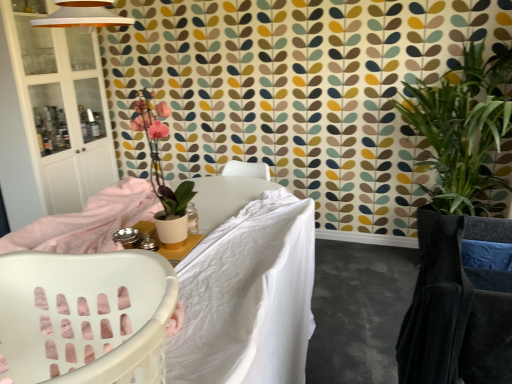
Question: Is white fabric bed at center not close to matte white pot at upper left, marked as the 1th houseplant in a left-to-right arrangement?

Choices:
 (A) no
 (B) yes

Answer: (B)

Question: From the image's perspective, is white fabric bed at center over matte white pot at upper left, arranged as the second houseplant when viewed from the back?

Choices:
 (A) no
 (B) yes

Answer: (A)

Question: Is the position of white fabric bed at center less distant than that of matte white pot at upper left, which ranks as the first houseplant in front-to-back order?

Choices:
 (A) yes
 (B) no

Answer: (A)

Question: From a real-world perspective, is white fabric bed at center physically above matte white pot at upper left, which ranks as the first houseplant in front-to-back order?

Choices:
 (A) no
 (B) yes

Answer: (A)

Question: Considering the relative sizes of white fabric bed at center and matte white pot at upper left, marked as the 1th houseplant in a left-to-right arrangement, in the image provided, is white fabric bed at center smaller than matte white pot at upper left, marked as the 1th houseplant in a left-to-right arrangement,?

Choices:
 (A) no
 (B) yes

Answer: (A)

Question: From the image's perspective, is white fabric bed at center under matte white pot at upper left, which is the second houseplant in right-to-left order?

Choices:
 (A) yes
 (B) no

Answer: (A)

Question: Considering the relative sizes of matte white pot at upper left, marked as the 1th houseplant in a left-to-right arrangement, and matte white table at center in the image provided, is matte white pot at upper left, marked as the 1th houseplant in a left-to-right arrangement, smaller than matte white table at center?

Choices:
 (A) no
 (B) yes

Answer: (A)

Question: Would you consider matte white pot at upper left, which is the second houseplant in right-to-left order, to be distant from matte white table at center?

Choices:
 (A) no
 (B) yes

Answer: (B)

Question: From a real-world perspective, is matte white pot at upper left, arranged as the second houseplant when viewed from the back, over matte white table at center?

Choices:
 (A) no
 (B) yes

Answer: (B)

Question: Is matte white pot at upper left, marked as the 1th houseplant in a left-to-right arrangement, not inside matte white table at center?

Choices:
 (A) yes
 (B) no

Answer: (A)

Question: From a real-world perspective, is matte white pot at upper left, arranged as the second houseplant when viewed from the back, below matte white table at center?

Choices:
 (A) yes
 (B) no

Answer: (B)

Question: Is matte white pot at upper left, which is the second houseplant in right-to-left order, with matte white table at center?

Choices:
 (A) no
 (B) yes

Answer: (A)

Question: Is white fabric bed at center touching white glass cabinet at left?

Choices:
 (A) yes
 (B) no

Answer: (B)